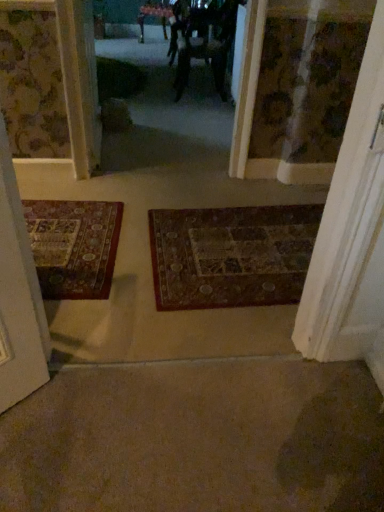
Question: From the image's perspective, is dark brown woven mat at center under dark fabric couple at center?

Choices:
 (A) yes
 (B) no

Answer: (A)

Question: Is dark brown woven mat at center wider than dark fabric couple at center?

Choices:
 (A) yes
 (B) no

Answer: (A)

Question: Is the position of dark brown woven mat at center more distant than that of dark fabric couple at center?

Choices:
 (A) yes
 (B) no

Answer: (B)

Question: Can you confirm if dark brown woven mat at center is thinner than dark fabric couple at center?

Choices:
 (A) no
 (B) yes

Answer: (A)

Question: Are dark brown woven mat at center and dark fabric couple at center far apart?

Choices:
 (A) yes
 (B) no

Answer: (A)

Question: Is dark brown woven mat at center facing towards dark fabric couple at center?

Choices:
 (A) yes
 (B) no

Answer: (B)

Question: Is dark fabric couple at center positioned with its back to metallic silver mirror at upper center?

Choices:
 (A) no
 (B) yes

Answer: (A)

Question: Can we say dark fabric couple at center lies outside metallic silver mirror at upper center?

Choices:
 (A) no
 (B) yes

Answer: (B)

Question: From a real-world perspective, does dark fabric couple at center sit lower than metallic silver mirror at upper center?

Choices:
 (A) no
 (B) yes

Answer: (A)

Question: Considering the relative sizes of dark fabric couple at center and metallic silver mirror at upper center in the image provided, is dark fabric couple at center taller than metallic silver mirror at upper center?

Choices:
 (A) no
 (B) yes

Answer: (B)

Question: Is dark fabric couple at center oriented towards metallic silver mirror at upper center?

Choices:
 (A) no
 (B) yes

Answer: (A)

Question: Is dark fabric couple at center behind metallic silver mirror at upper center?

Choices:
 (A) no
 (B) yes

Answer: (A)

Question: Is dark brown woven mat at center positioned far away from wooden door at right?

Choices:
 (A) no
 (B) yes

Answer: (A)